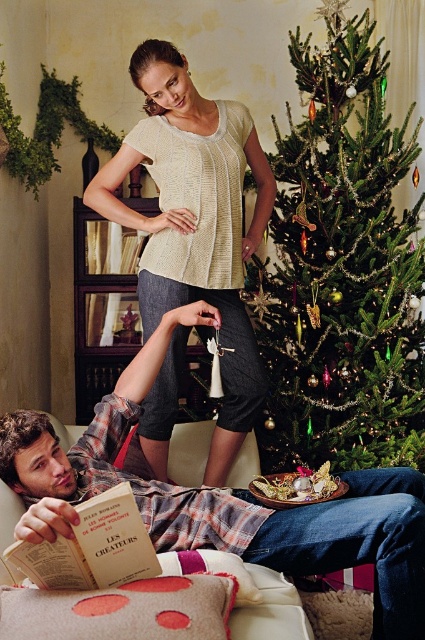
Question: Is plaid fabric shirt at lower left bigger than hardcover book at lower left?

Choices:
 (A) no
 (B) yes

Answer: (B)

Question: Which point appears farthest from the camera in this image?

Choices:
 (A) (189, 236)
 (B) (399, 156)

Answer: (B)

Question: Which of the following is the farthest from the observer?

Choices:
 (A) (397, 323)
 (B) (152, 230)

Answer: (A)

Question: Which object is closer to the camera taking this photo?

Choices:
 (A) green textured christmas tree at center
 (B) hardcover book at lower left
 (C) plaid fabric shirt at lower left

Answer: (B)

Question: Is the position of plaid fabric shirt at lower left more distant than that of knitted beige top at center?

Choices:
 (A) yes
 (B) no

Answer: (B)

Question: Observing the image, what is the correct spatial positioning of plaid fabric shirt at lower left in reference to knitted beige top at center?

Choices:
 (A) above
 (B) below

Answer: (B)